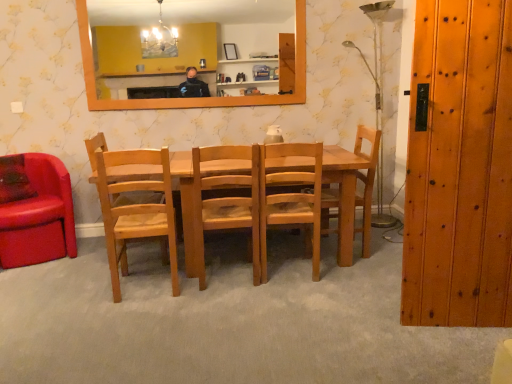
This screenshot has height=384, width=512. I want to click on vacant space to the left of wooden door at right, so click(390, 328).